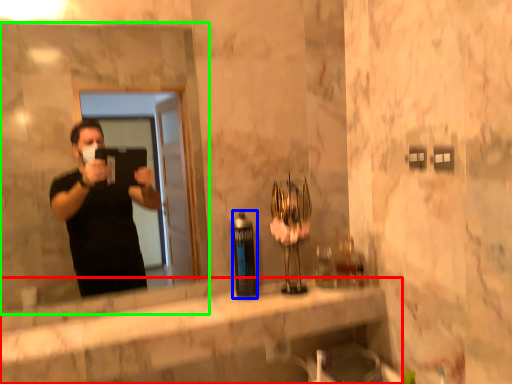
Question: Based on their relative distances, which object is nearer to counter top (highlighted by a red box)? Choose from bottle (highlighted by a blue box) and mirror (highlighted by a green box).

Choices:
 (A) bottle
 (B) mirror

Answer: (A)